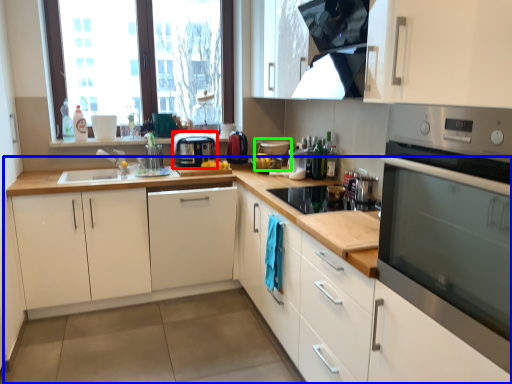
Question: Which object is positioned closest to kitchen appliance (highlighted by a red box)? Select from countertop (highlighted by a blue box) and appliance (highlighted by a green box).

Choices:
 (A) countertop
 (B) appliance

Answer: (B)